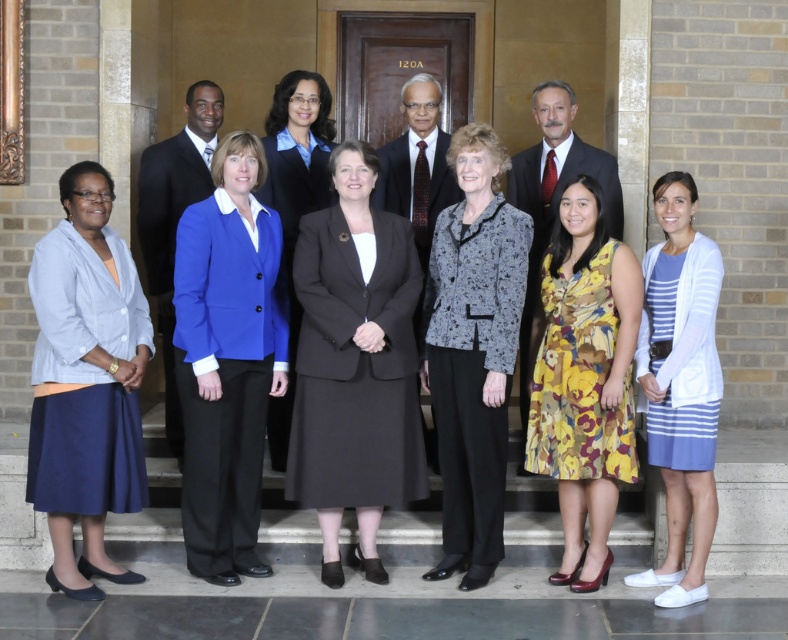
Is light blue fabric skirt at lower left below shiny black suit at center?

Indeed, light blue fabric skirt at lower left is positioned under shiny black suit at center.

Who is positioned more to the right, light blue fabric skirt at lower left or shiny black suit at center?

From the viewer's perspective, shiny black suit at center appears more on the right side.

What are the coordinates of `light blue fabric skirt at lower left` in the screenshot? It's located at (86, 381).

The width and height of the screenshot is (788, 640). In order to click on light blue fabric skirt at lower left in this screenshot , I will do `click(86, 381)`.

Does white striped dress at lower right have a smaller size compared to dark gray suit at center?

No, white striped dress at lower right is not smaller than dark gray suit at center.

Can you confirm if white striped dress at lower right is positioned below dark gray suit at center?

Yes.

The height and width of the screenshot is (640, 788). Describe the element at coordinates (679, 385) in the screenshot. I see `white striped dress at lower right` at that location.

Locate an element on the screen. This screenshot has width=788, height=640. white striped dress at lower right is located at coordinates (679, 385).

Who is more forward, (98, 307) or (456, 401)?

Point (98, 307) is in front.

Find the location of a particular element. This screenshot has width=788, height=640. light blue fabric skirt at lower left is located at coordinates (86, 381).

Is point (132, 474) behind point (511, 301)?

No, it is in front of (511, 301).

The width and height of the screenshot is (788, 640). Identify the location of light blue fabric skirt at lower left. (86, 381).